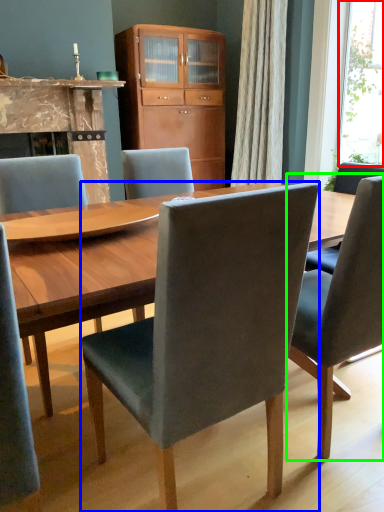
Question: Which is farther away from window screen (highlighted by a red box)? chair (highlighted by a blue box) or chair (highlighted by a green box)?

Choices:
 (A) chair
 (B) chair

Answer: (A)